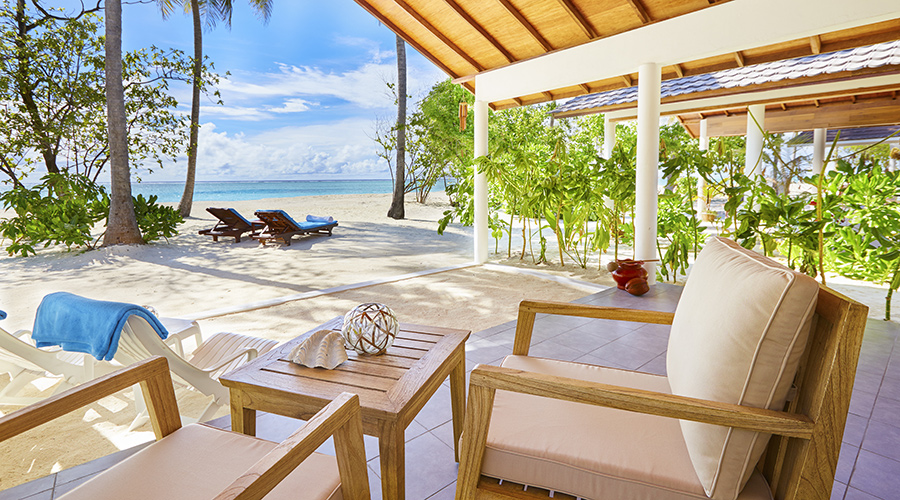
This screenshot has width=900, height=500. I want to click on decorative ball, so click(x=374, y=317).